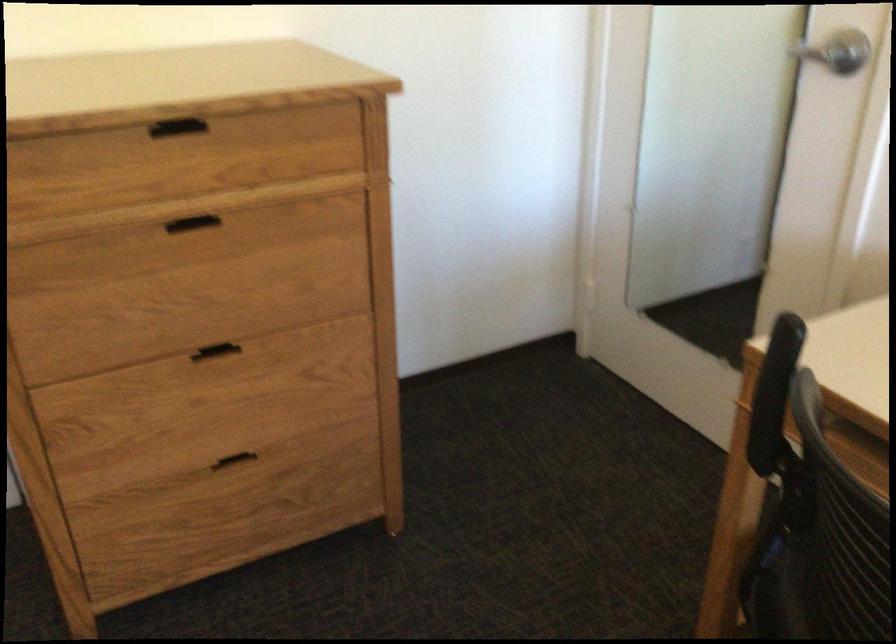
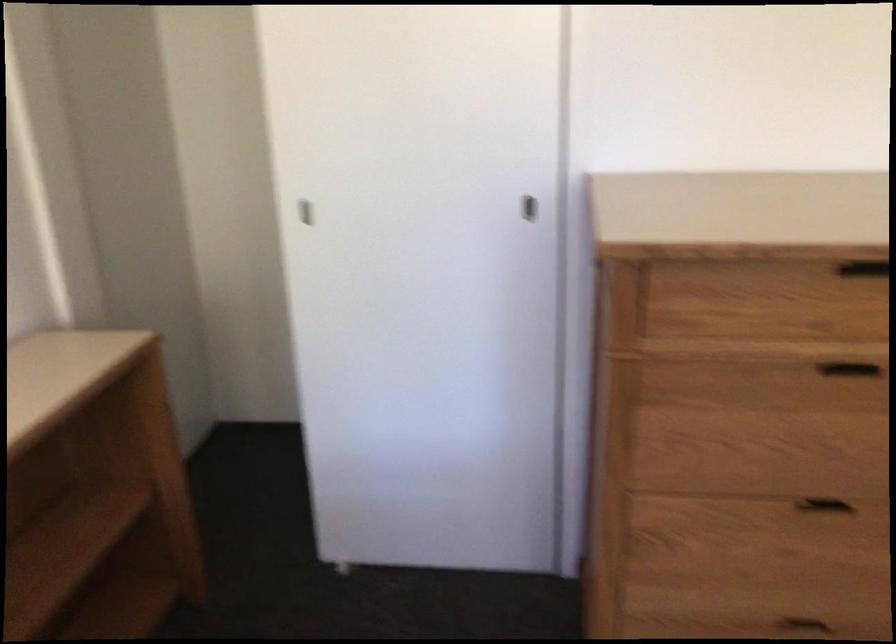
Question: Based on the continuous images, in which direction is the camera rotating? Reply with the corresponding letter.

Choices:
 (A) Left
 (B) Right
 (C) Up
 (D) Down

Answer: (A)